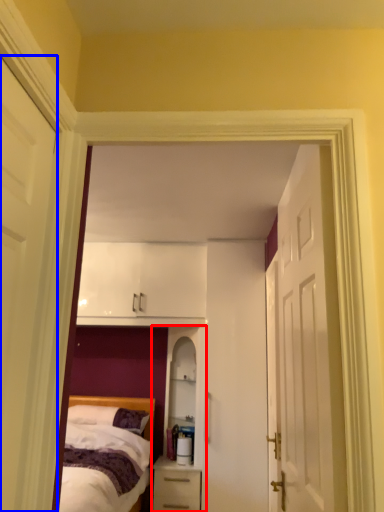
Question: Among these objects, which one is nearest to the camera, dresser (highlighted by a red box) or door (highlighted by a blue box)?

Choices:
 (A) dresser
 (B) door

Answer: (B)